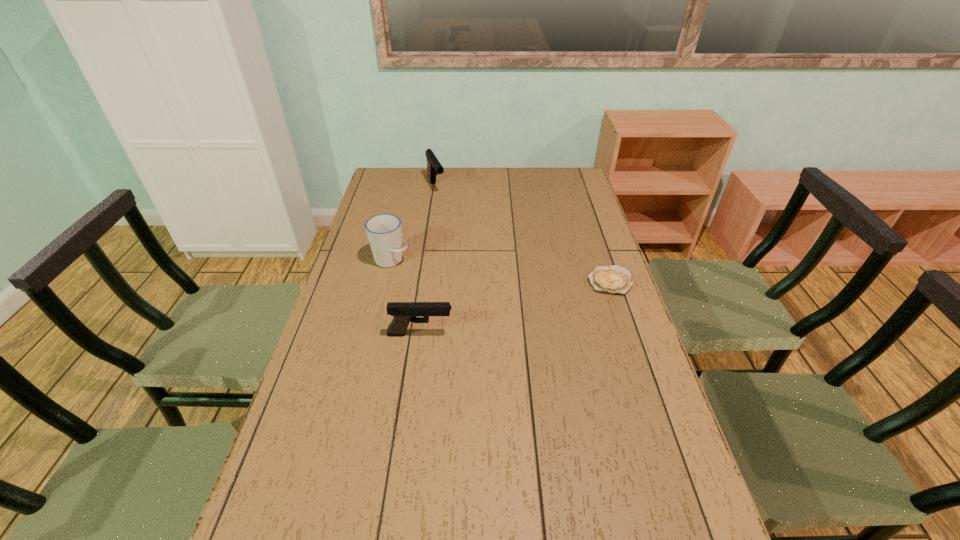
Where is `empty space that is in between the rightmost object and the shorter pistol`? The image size is (960, 540). empty space that is in between the rightmost object and the shorter pistol is located at coordinates (515, 307).

Identify the location of free space between the farther pistol and the rightmost object. (523, 234).

Locate an element on the screen. This screenshot has width=960, height=540. object that is the second closest to the nearest object is located at coordinates (614, 279).

This screenshot has width=960, height=540. What are the coordinates of `object that ranks as the third closest to the taller pistol` in the screenshot? It's located at (403, 313).

Locate an element on the screen. The height and width of the screenshot is (540, 960). free location that satisfies the following two spatial constraints: 1. on the back side of the taller pistol; 2. on the left side of the cup is located at coordinates (409, 187).

Find the location of a particular element. vacant region that satisfies the following two spatial constraints: 1. on the front side of the farther pistol; 2. on the front-facing side of the third tallest object is located at coordinates (414, 334).